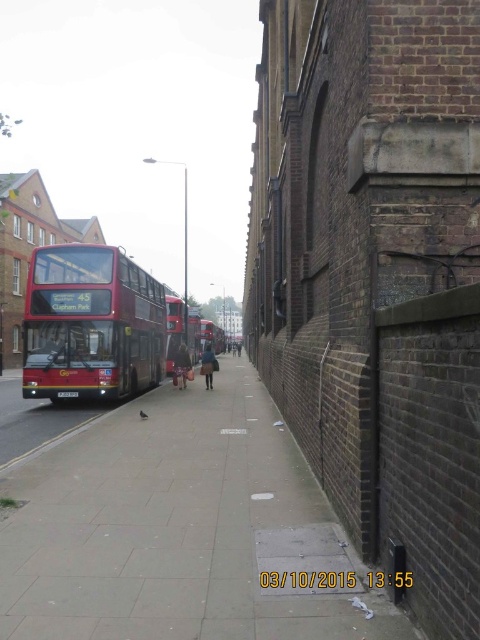
Looking at this image, you are standing on the sidewalk next to the tall brick wall on the right. You see a point marked at coordinate (179, 529). What type of surface is the point located on?

The point is on smooth concrete pavement at center.

You are a delivery person carrying a large package that requires placing on the ground. You see the smooth concrete pavement at center and the dark blue fabric coat at center in the scene. Which surface would you choose to place your package and why?

Result: The smooth concrete pavement at center has a larger size compared to the dark blue fabric coat at center, so it is more suitable for placing the large package as it provides a stable and spacious surface.